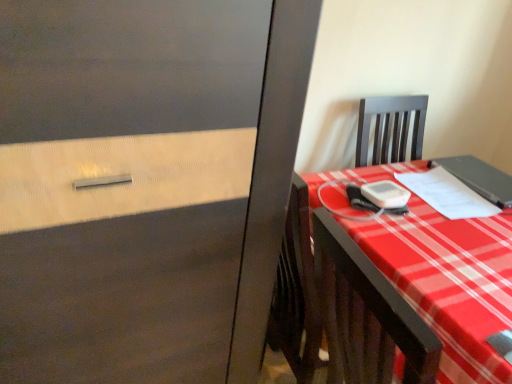
How much space does white paper at right, marked as the second notebook in a right-to-left arrangement, occupy horizontally?

white paper at right, marked as the second notebook in a right-to-left arrangement, is 12.95 inches wide.

Find the location of a particular element. This screenshot has width=512, height=384. matte black notebook at right, which is counted as the first notebook, starting from the right is located at coordinates (479, 178).

Can you tell me how much plaid fabric desk at right and matte black notebook at right, which is counted as the first notebook, starting from the right, differ in facing direction?

plaid fabric desk at right and matte black notebook at right, which is counted as the first notebook, starting from the right, are facing 1.35e-05 degrees away from each other.

Which of these two, plaid fabric desk at right or matte black notebook at right, which is counted as the first notebook, starting from the right, is wider?

Wider between the two is plaid fabric desk at right.

From the image's perspective, which object appears higher, plaid fabric desk at right or matte black notebook at right, which ranks as the 2th notebook in left-to-right order?

matte black notebook at right, which ranks as the 2th notebook in left-to-right order.

In the image, is plaid fabric desk at right on the left side or the right side of matte black notebook at right, which ranks as the 2th notebook in left-to-right order?

In the image, plaid fabric desk at right appears on the left side of matte black notebook at right, which ranks as the 2th notebook in left-to-right order.

Considering the relative sizes of white paper at right, arranged as the 1th notebook when viewed from the left, and plaid fabric desk at right in the image provided, is white paper at right, arranged as the 1th notebook when viewed from the left, taller than plaid fabric desk at right?

Incorrect, the height of white paper at right, arranged as the 1th notebook when viewed from the left, is not larger of that of plaid fabric desk at right.

From the picture: Is white paper at right, arranged as the 1th notebook when viewed from the left, facing away from plaid fabric desk at right?

Absolutely, white paper at right, arranged as the 1th notebook when viewed from the left, is directed away from plaid fabric desk at right.

Considering the points (436, 204) and (468, 367), which point is in front, point (436, 204) or point (468, 367)?

The point (468, 367) is closer to the camera.

Would you consider white paper at right, marked as the second notebook in a right-to-left arrangement, to be distant from plaid fabric desk at right?

That's not correct — white paper at right, marked as the second notebook in a right-to-left arrangement, is a little close to plaid fabric desk at right.

Which is correct: white paper at right, arranged as the 1th notebook when viewed from the left, is inside matte black notebook at right, which ranks as the 2th notebook in left-to-right order, or outside of it?

white paper at right, arranged as the 1th notebook when viewed from the left, is not inside matte black notebook at right, which ranks as the 2th notebook in left-to-right order, it's outside.

Is white paper at right, marked as the second notebook in a right-to-left arrangement, facing away from matte black notebook at right, which ranks as the 2th notebook in left-to-right order?

No, white paper at right, marked as the second notebook in a right-to-left arrangement, is not facing the opposite direction of matte black notebook at right, which ranks as the 2th notebook in left-to-right order.

Where is `notebook that is above the white paper at right, arranged as the 1th notebook when viewed from the left (from the image's perspective)`? Image resolution: width=512 pixels, height=384 pixels. notebook that is above the white paper at right, arranged as the 1th notebook when viewed from the left (from the image's perspective) is located at coordinates (479, 178).

Is plaid fabric desk at right aimed at white paper at right, marked as the second notebook in a right-to-left arrangement?

Yes, plaid fabric desk at right faces towards white paper at right, marked as the second notebook in a right-to-left arrangement.

How different are the orientations of plaid fabric desk at right and white paper at right, arranged as the 1th notebook when viewed from the left, in degrees?

plaid fabric desk at right and white paper at right, arranged as the 1th notebook when viewed from the left, are facing 6.88 degrees away from each other.

Is plaid fabric desk at right taller or shorter than white paper at right, marked as the second notebook in a right-to-left arrangement?

plaid fabric desk at right is taller than white paper at right, marked as the second notebook in a right-to-left arrangement.

Looking at the image, does plaid fabric desk at right seem bigger or smaller compared to white paper at right, arranged as the 1th notebook when viewed from the left?

In the image, plaid fabric desk at right appears to be larger than white paper at right, arranged as the 1th notebook when viewed from the left.

Looking at this image, would you consider matte black notebook at right, which ranks as the 2th notebook in left-to-right order, to be distant from white paper at right, marked as the second notebook in a right-to-left arrangement?

No.

How distant is matte black notebook at right, which is counted as the first notebook, starting from the right, from white paper at right, marked as the second notebook in a right-to-left arrangement?

matte black notebook at right, which is counted as the first notebook, starting from the right, and white paper at right, marked as the second notebook in a right-to-left arrangement, are 3.91 inches apart.

Could white paper at right, marked as the second notebook in a right-to-left arrangement, be considered to be inside matte black notebook at right, which ranks as the 2th notebook in left-to-right order?

No, white paper at right, marked as the second notebook in a right-to-left arrangement, is located outside of matte black notebook at right, which ranks as the 2th notebook in left-to-right order.

Consider the image. From a real-world perspective, between matte black notebook at right, which ranks as the 2th notebook in left-to-right order, and white paper at right, marked as the second notebook in a right-to-left arrangement, who is vertically higher?

In real-world perspective, matte black notebook at right, which ranks as the 2th notebook in left-to-right order, is above.

Considering the sizes of objects matte black notebook at right, which ranks as the 2th notebook in left-to-right order, and plaid fabric desk at right in the image provided, who is thinner, matte black notebook at right, which ranks as the 2th notebook in left-to-right order, or plaid fabric desk at right?

matte black notebook at right, which ranks as the 2th notebook in left-to-right order, is thinner.

Considering the sizes of objects matte black notebook at right, which ranks as the 2th notebook in left-to-right order, and plaid fabric desk at right in the image provided, who is taller, matte black notebook at right, which ranks as the 2th notebook in left-to-right order, or plaid fabric desk at right?

plaid fabric desk at right.

Is point (471, 157) closer to camera compared to point (455, 375)?

No, (471, 157) is behind (455, 375).

In the image, is matte black notebook at right, which is counted as the first notebook, starting from the right, positioned in front of or behind plaid fabric desk at right?

Clearly, matte black notebook at right, which is counted as the first notebook, starting from the right, is behind plaid fabric desk at right.

From the image's perspective, which notebook is the 2nd one above the plaid fabric desk at right? Please provide its 2D coordinates.

[(479, 178)]

Where is `desk on the left of white paper at right, arranged as the 1th notebook when viewed from the left`? The height and width of the screenshot is (384, 512). desk on the left of white paper at right, arranged as the 1th notebook when viewed from the left is located at coordinates (449, 281).

Estimate the real-world distances between objects in this image. Which object is further from white paper at right, arranged as the 1th notebook when viewed from the left, plaid fabric desk at right or matte black notebook at right, which ranks as the 2th notebook in left-to-right order?

plaid fabric desk at right is further to white paper at right, arranged as the 1th notebook when viewed from the left.

Based on their spatial positions, is matte black notebook at right, which ranks as the 2th notebook in left-to-right order, or plaid fabric desk at right closer to white paper at right, marked as the second notebook in a right-to-left arrangement?

Among the two, matte black notebook at right, which ranks as the 2th notebook in left-to-right order, is located nearer to white paper at right, marked as the second notebook in a right-to-left arrangement.

Estimate the real-world distances between objects in this image. Which object is further from plaid fabric desk at right, matte black notebook at right, which ranks as the 2th notebook in left-to-right order, or white paper at right, arranged as the 1th notebook when viewed from the left?

Among the two, matte black notebook at right, which ranks as the 2th notebook in left-to-right order, is located further to plaid fabric desk at right.

From the picture: Looking at the image, which one is located closer to matte black notebook at right, which is counted as the first notebook, starting from the right, white paper at right, arranged as the 1th notebook when viewed from the left, or plaid fabric desk at right?

white paper at right, arranged as the 1th notebook when viewed from the left, is positioned closer to the anchor matte black notebook at right, which is counted as the first notebook, starting from the right.

Based on their spatial positions, is white paper at right, marked as the second notebook in a right-to-left arrangement, or matte black notebook at right, which is counted as the first notebook, starting from the right, closer to plaid fabric desk at right?

white paper at right, marked as the second notebook in a right-to-left arrangement.

From the picture: When comparing their distances from matte black notebook at right, which ranks as the 2th notebook in left-to-right order, does plaid fabric desk at right or white paper at right, arranged as the 1th notebook when viewed from the left, seem further?

The object further to matte black notebook at right, which ranks as the 2th notebook in left-to-right order, is plaid fabric desk at right.

Identify the location of notebook between matte black notebook at right, which ranks as the 2th notebook in left-to-right order, and plaid fabric desk at right in the up-down direction. The height and width of the screenshot is (384, 512). click(x=447, y=194).